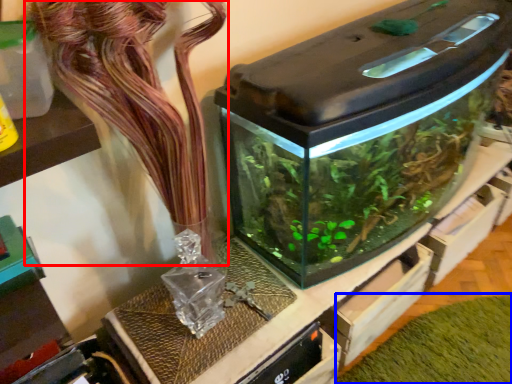
Question: Which of the following is the closest to the observer, flower (highlighted by a red box) or plant (highlighted by a blue box)?

Choices:
 (A) flower
 (B) plant

Answer: (A)